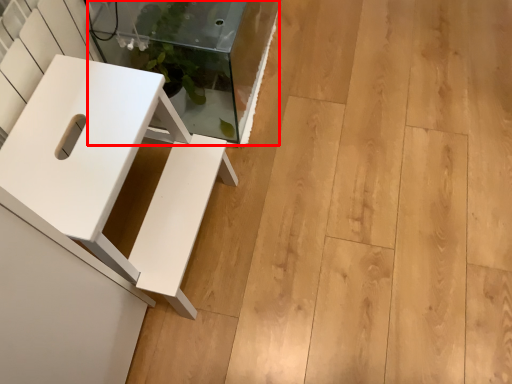
Question: Where is glass table (annotated by the red box) located in relation to furniture in the image?

Choices:
 (A) left
 (B) right

Answer: (B)